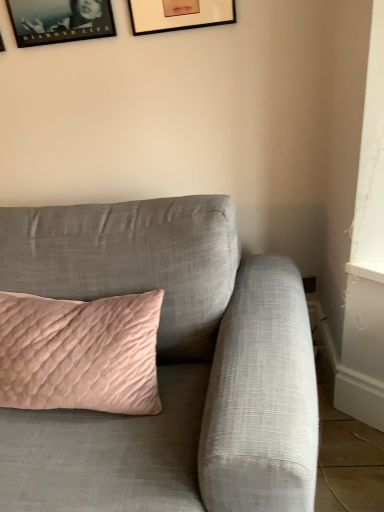
Question: In the image, is matte gray couch at center positioned in front of or behind matte black picture frame at upper left, placed as the 2th picture frame when sorted from right to left?

Choices:
 (A) front
 (B) behind

Answer: (A)

Question: In the image, is matte gray couch at center on the left side or the right side of matte black picture frame at upper left, placed as the 2th picture frame when sorted from right to left?

Choices:
 (A) left
 (B) right

Answer: (B)

Question: Estimate the real-world distances between objects in this image. Which object is farther from the matte black picture frame at upper left, which is counted as the first picture frame, starting from the left?

Choices:
 (A) matte black picture frame at upper center, which appears as the first picture frame when viewed from the right
 (B) matte gray couch at center
 (C) matte black picture frame at upper left, placed as the 2th picture frame when sorted from right to left

Answer: (B)

Question: Which object is the farthest from the matte black picture frame at upper left, placed as the 2th picture frame when sorted from right to left?

Choices:
 (A) matte black picture frame at upper center, which appears as the first picture frame when viewed from the right
 (B) matte black picture frame at upper left, positioned as the 3th picture frame in right-to-left order
 (C) matte gray couch at center

Answer: (C)